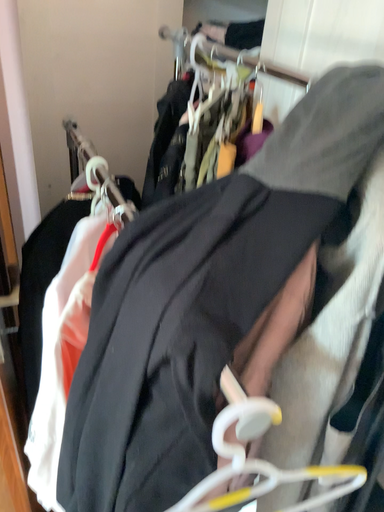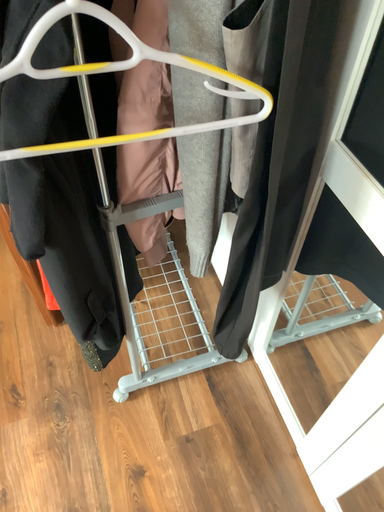
Question: Which way did the camera rotate in the video?

Choices:
 (A) rotated right
 (B) rotated left

Answer: (B)